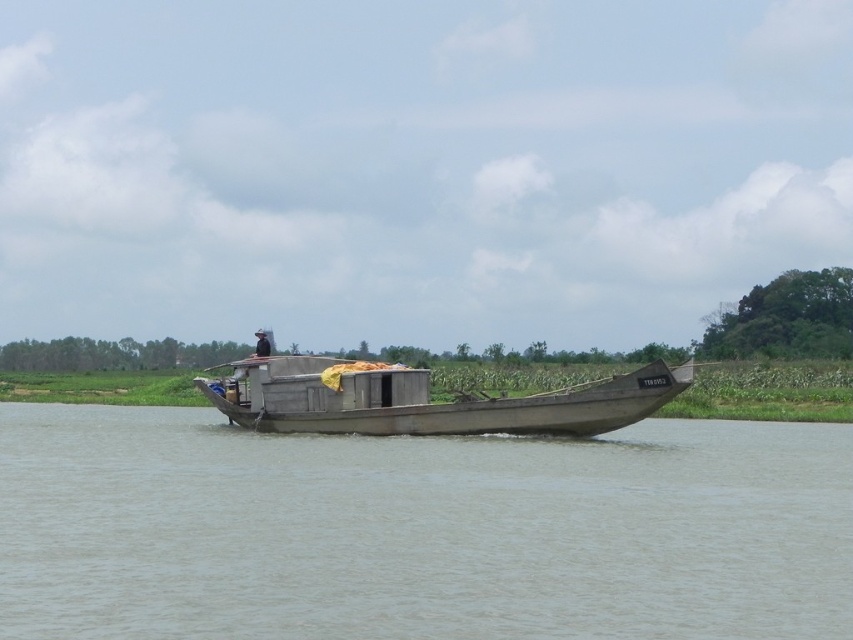
Based on the photo, you are a photographer trying to capture the boat in the river scene. You notice two points marked in the image. Which point, point 1 at coordinates (x=404, y=461) or point 2 at coordinates (x=421, y=387), is closer to your camera lens?

Point 1 at coordinates (x=404, y=461) is closer to the camera lens than point 2 at coordinates (x=421, y=387).